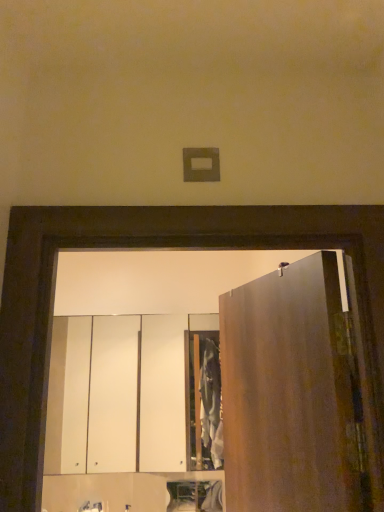
Question: From a real-world perspective, is white glossy cabinet at center, positioned as the 2th cabinetry in bottom-to-top order, over matte brown door at right?

Choices:
 (A) yes
 (B) no

Answer: (B)

Question: Is white glossy cabinet at center, positioned as the 2th cabinetry in bottom-to-top order, wider than matte brown door at right?

Choices:
 (A) no
 (B) yes

Answer: (A)

Question: Is white glossy cabinet at center, arranged as the 1th cabinetry when viewed from the top, smaller than matte brown door at right?

Choices:
 (A) yes
 (B) no

Answer: (A)

Question: Is white glossy cabinet at center, arranged as the 1th cabinetry when viewed from the top, outside of matte brown door at right?

Choices:
 (A) yes
 (B) no

Answer: (A)

Question: From the image's perspective, is white glossy cabinet at center, positioned as the 2th cabinetry in bottom-to-top order, beneath matte brown door at right?

Choices:
 (A) no
 (B) yes

Answer: (B)

Question: Does matte brown door at right appear on the left side of white glossy cabinet at lower center, the 1th cabinetry positioned from the bottom?

Choices:
 (A) yes
 (B) no

Answer: (B)

Question: Considering the relative sizes of matte brown door at right and white glossy cabinet at lower center, the 1th cabinetry positioned from the bottom, in the image provided, is matte brown door at right shorter than white glossy cabinet at lower center, the 1th cabinetry positioned from the bottom,?

Choices:
 (A) yes
 (B) no

Answer: (B)

Question: Considering the relative positions of matte brown door at right and white glossy cabinet at lower center, the 1th cabinetry positioned from the bottom, in the image provided, is matte brown door at right in front of white glossy cabinet at lower center, the 1th cabinetry positioned from the bottom,?

Choices:
 (A) yes
 (B) no

Answer: (A)

Question: Is white glossy cabinet at lower center, the 2th cabinetry positioned from the top, at the back of matte brown door at right?

Choices:
 (A) no
 (B) yes

Answer: (A)

Question: Can you confirm if matte brown door at right is bigger than white glossy cabinet at lower center, the 1th cabinetry positioned from the bottom?

Choices:
 (A) no
 (B) yes

Answer: (B)

Question: From a real-world perspective, is matte brown door at right located beneath white glossy cabinet at lower center, the 2th cabinetry positioned from the top?

Choices:
 (A) no
 (B) yes

Answer: (A)

Question: Is matte silver faucet at lower center aimed at matte brown door at right?

Choices:
 (A) no
 (B) yes

Answer: (A)